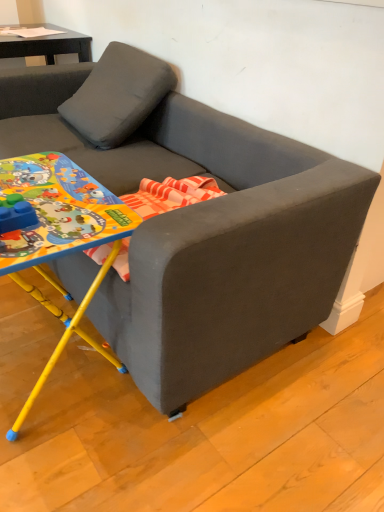
What do you see at coordinates (198, 223) in the screenshot? I see `matte gray couch at center` at bounding box center [198, 223].

This screenshot has width=384, height=512. I want to click on matte gray couch at center, so click(x=198, y=223).

Describe the element at coordinates (62, 232) in the screenshot. The image size is (384, 512). I see `yellow plastic table at lower left` at that location.

I want to click on yellow plastic table at lower left, so click(x=62, y=232).

Locate an element on the screen. The width and height of the screenshot is (384, 512). matte gray couch at center is located at coordinates (198, 223).

Can you confirm if matte gray couch at center is positioned to the left of yellow plastic table at lower left?

No.

Which object is further away from the camera taking this photo, matte gray couch at center or yellow plastic table at lower left?

yellow plastic table at lower left is behind.

Which point is more forward, (231, 284) or (72, 212)?

The point (231, 284) is closer.

From the image's perspective, is matte gray couch at center positioned above or below yellow plastic table at lower left?

matte gray couch at center is above yellow plastic table at lower left.

From a real-world perspective, is matte gray couch at center above or below yellow plastic table at lower left?

From a real-world perspective, matte gray couch at center is physically above yellow plastic table at lower left.

Considering the sizes of matte gray couch at center and yellow plastic table at lower left in the image, is matte gray couch at center wider or thinner than yellow plastic table at lower left?

Clearly, matte gray couch at center has more width compared to yellow plastic table at lower left.

From the picture: Who is taller, matte gray couch at center or yellow plastic table at lower left?

With more height is matte gray couch at center.

Considering the relative sizes of matte gray couch at center and yellow plastic table at lower left in the image provided, is matte gray couch at center smaller than yellow plastic table at lower left?

Incorrect, matte gray couch at center is not smaller in size than yellow plastic table at lower left.

Would you say matte gray couch at center is outside yellow plastic table at lower left?

Yes, matte gray couch at center is not within yellow plastic table at lower left.

Is the surface of matte gray couch at center in direct contact with yellow plastic table at lower left?

No, matte gray couch at center is not next to yellow plastic table at lower left.

Is yellow plastic table at lower left at the back of matte gray couch at center?

That's right, matte gray couch at center is facing away from yellow plastic table at lower left.

How different are the orientations of matte gray couch at center and yellow plastic table at lower left in degrees?

They differ by 0.000872 degrees in their facing directions.

Measure the distance between matte gray couch at center and yellow plastic table at lower left.

The distance of matte gray couch at center from yellow plastic table at lower left is 14.46 inches.

At what (x,y) coordinates should I click in order to perform the action: click on studio couch that is above the yellow plastic table at lower left (from a real-world perspective). Please return your answer as a coordinate pair (x, y). The height and width of the screenshot is (512, 384). Looking at the image, I should click on (198, 223).

Looking at this image, considering the positions of objects yellow plastic table at lower left and matte gray couch at center in the image provided, who is more to the left, yellow plastic table at lower left or matte gray couch at center?

Positioned to the left is yellow plastic table at lower left.

Is yellow plastic table at lower left further to camera compared to matte gray couch at center?

Yes, it is.

Which point is more forward, (67, 173) or (282, 224)?

The point (282, 224) is more forward.

From the image's perspective, is yellow plastic table at lower left positioned above or below matte gray couch at center?

yellow plastic table at lower left is below matte gray couch at center.

From a real-world perspective, is yellow plastic table at lower left physically located above or below matte gray couch at center?

From a real-world perspective, yellow plastic table at lower left is physically below matte gray couch at center.

Looking at their sizes, would you say yellow plastic table at lower left is wider or thinner than matte gray couch at center?

Considering their sizes, yellow plastic table at lower left looks slimmer than matte gray couch at center.

Which of these two, yellow plastic table at lower left or matte gray couch at center, stands shorter?

Standing shorter between the two is yellow plastic table at lower left.

Between yellow plastic table at lower left and matte gray couch at center, which one has larger size?

Bigger between the two is matte gray couch at center.

Does yellow plastic table at lower left contain matte gray couch at center?

No, matte gray couch at center is not a part of yellow plastic table at lower left.

Is yellow plastic table at lower left far from matte gray couch at center?

They are positioned close to each other.

Is yellow plastic table at lower left oriented towards matte gray couch at center?

No, yellow plastic table at lower left is not facing towards matte gray couch at center.

What's the angular difference between yellow plastic table at lower left and matte gray couch at center's facing directions?

The angular difference between yellow plastic table at lower left and matte gray couch at center is 0.000872 degrees.

How distant is yellow plastic table at lower left from matte gray couch at center?

They are 14.46 inches apart.

Where is `studio couch above the yellow plastic table at lower left (from the image's perspective)`? The width and height of the screenshot is (384, 512). studio couch above the yellow plastic table at lower left (from the image's perspective) is located at coordinates (198, 223).

This screenshot has width=384, height=512. Identify the location of studio couch that is above the yellow plastic table at lower left (from a real-world perspective). click(x=198, y=223).

You are a GUI agent. You are given a task and a screenshot of the screen. Output one action in this format:
    pyautogui.click(x=<x>, y=<y>)
    Task: Click on the studio couch above the yellow plastic table at lower left (from the image's perspective)
    The image size is (384, 512).
    Given the screenshot: What is the action you would take?
    pyautogui.click(x=198, y=223)